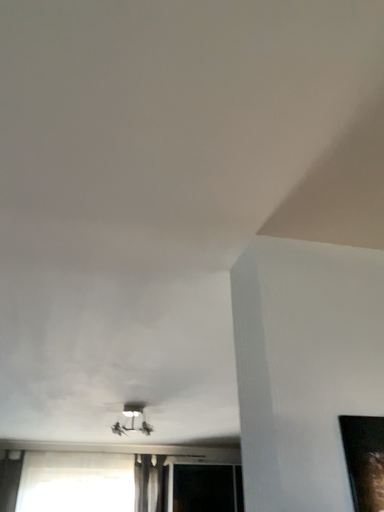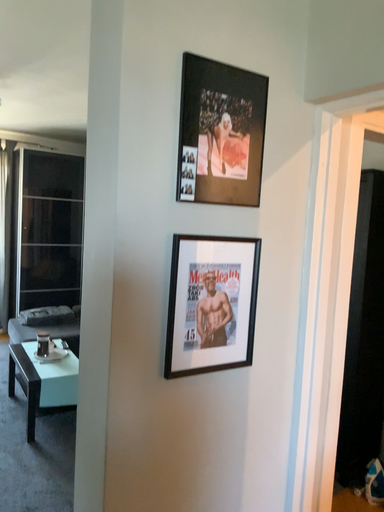
Question: Which way did the camera rotate in the video?

Choices:
 (A) rotated upward
 (B) rotated downward

Answer: (B)